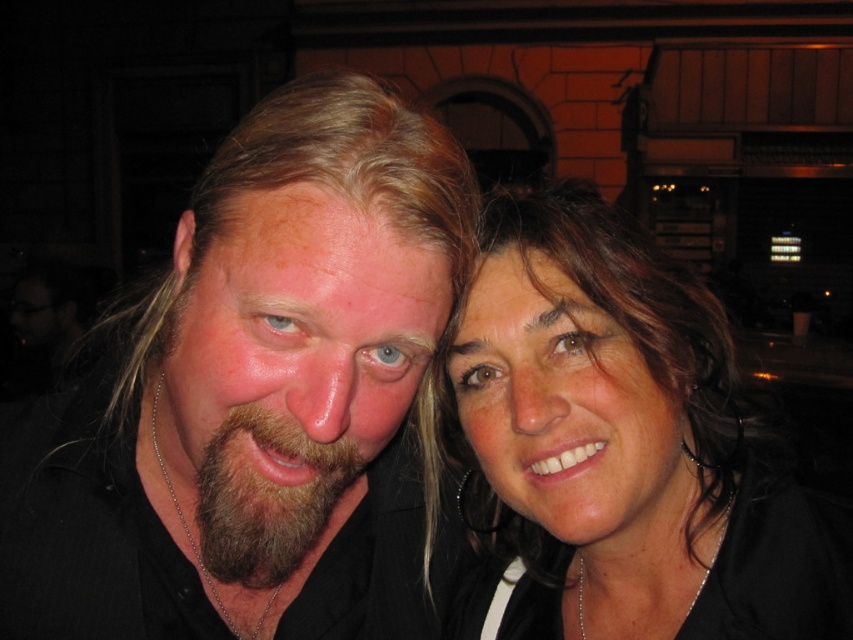
You are a photographer trying to focus on the matte black hair at center in the image. The camera you are using has a focus point at position point (254, 397). Is this focus point correctly positioned to capture the matte black hair at center?

Yes, the focus point at point (254, 397) is correctly positioned because the Objects Description states that point (254, 397) marks the matte black hair at center.

You are a photographer trying to adjust the lighting for a photo shoot. You notice two areas with matte black hair at center and matte black hair at upper right. Which area requires more light adjustment to ensure proper exposure?

The matte black hair at center requires more light adjustment because it has a greater height compared to the matte black hair at upper right, so it might cast a larger shadow or need more illumination to capture details properly.

You are a photographer trying to focus on the matte black hair at center and the matte black hair at upper right. Which one should you choose if you want to capture the larger one in your frame?

The matte black hair at center is larger in size than the matte black hair at upper right, so you should choose the matte black hair at center to capture the larger one in your frame.